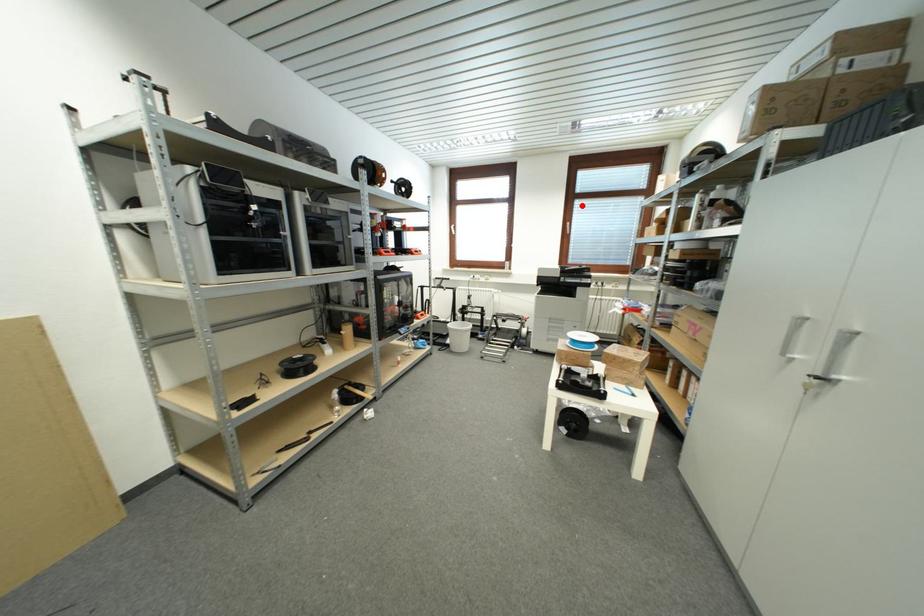
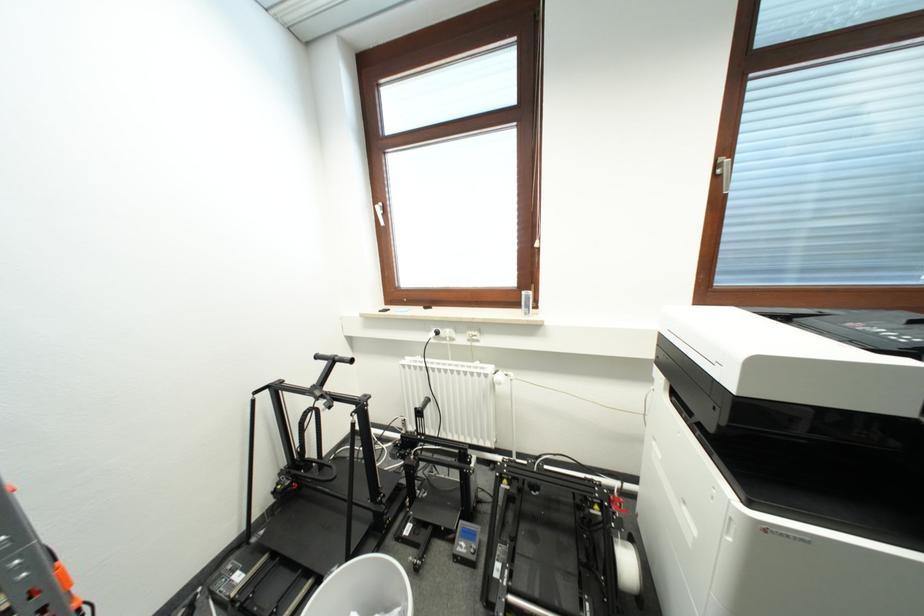
Find the pixel in the second image that matches the highlighted location in the first image.

(766, 89)